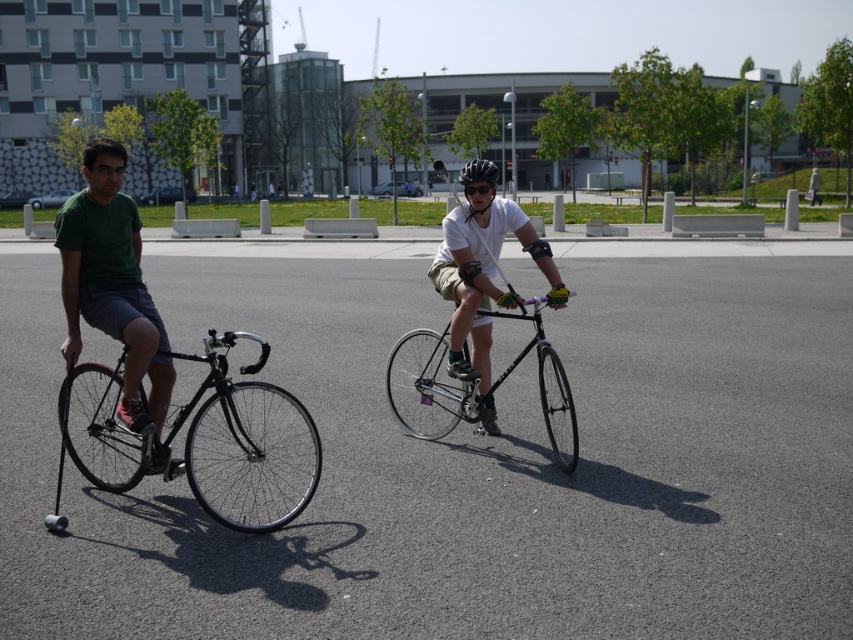
You are a delivery person who needs to choose between the shiny black bicycle at left and the shiny black bicycle at center for a job that requires carrying heavy packages. Which bicycle would be more suitable based on their sizes?

The shiny black bicycle at center is taller than the shiny black bicycle at left, making it more suitable for carrying heavy packages as taller bicycles often have a higher frame that can accommodate larger cargo racks.

You are a cyclist trying to pass the shiny black bicycle at left and the matte black bicycle at center. Which bicycle should you overtake first based on their positions?

You should overtake the shiny black bicycle at left first since it is positioned on the left side of the matte black bicycle at center, meaning it is ahead in the current path.

You are a delivery person who needs to choose between the shiny black bicycle at left and the shiny black bicycle at center for a long delivery route. Which bicycle should you choose based on their sizes?

You should choose the shiny black bicycle at left because it is bigger than the shiny black bicycle at center, making it more suitable for carrying heavier loads during long deliveries.